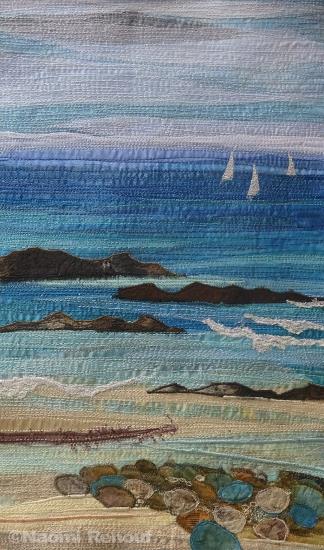
Where is `quilting`? The image size is (324, 550). quilting is located at coordinates (292, 471).